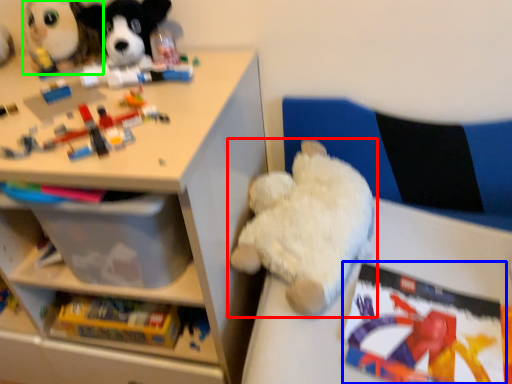
Question: Which object is the closest to the toy (highlighted by a red box)? Choose among these: book (highlighted by a blue box) or toy (highlighted by a green box).

Choices:
 (A) book
 (B) toy

Answer: (A)